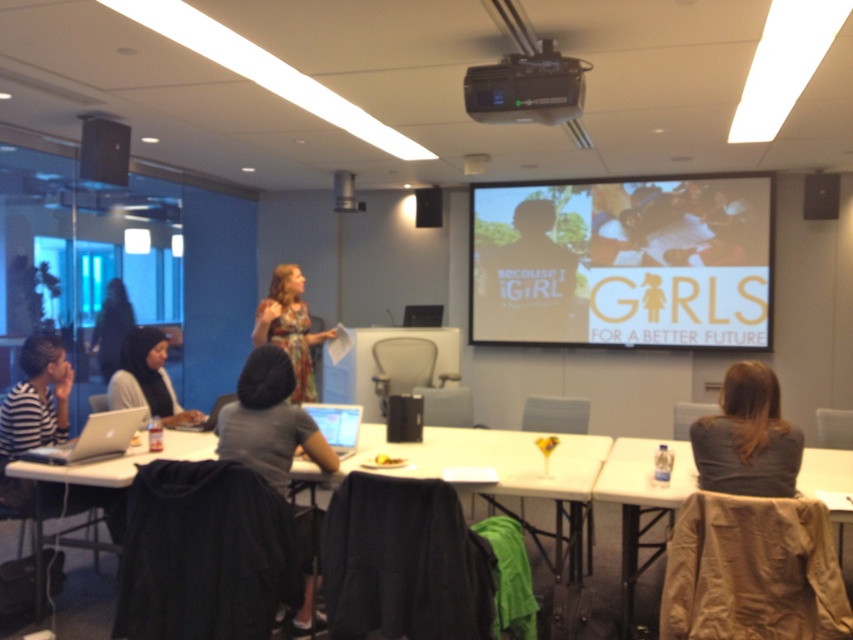
Question: Is white glossy poster at center below gray fabric jacket at lower right?

Choices:
 (A) no
 (B) yes

Answer: (A)

Question: Which object appears closest to the camera in this image?

Choices:
 (A) matte white projector screen at upper center
 (B) white glossy poster at center
 (C) white plastic table at lower right

Answer: (C)

Question: Which object is farther from the camera taking this photo?

Choices:
 (A) black plastic projector at upper center
 (B) gray fabric jacket at lower right
 (C) matte black hijab at left
 (D) silver metallic laptop at lower center

Answer: (C)

Question: Does white plastic table at lower center have a smaller size compared to matte black hijab at left?

Choices:
 (A) no
 (B) yes

Answer: (A)

Question: Can you confirm if white plastic table at lower right is smaller than silver metallic laptop at center?

Choices:
 (A) yes
 (B) no

Answer: (B)

Question: Among these objects, which one is nearest to the camera?

Choices:
 (A) matte white projector screen at upper center
 (B) white glossy poster at center
 (C) white plastic table at lower right

Answer: (C)